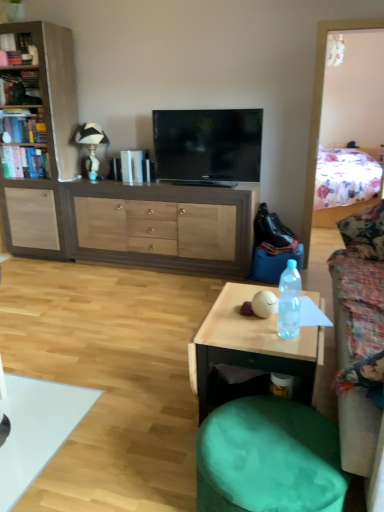
Question: From a real-world perspective, is green fabric swivel chair at lower right located beneath clear plastic bottle at center?

Choices:
 (A) yes
 (B) no

Answer: (A)

Question: Is green fabric swivel chair at lower right closer to the viewer compared to clear plastic bottle at center?

Choices:
 (A) yes
 (B) no

Answer: (A)

Question: From the image's perspective, is green fabric swivel chair at lower right under clear plastic bottle at center?

Choices:
 (A) no
 (B) yes

Answer: (B)

Question: Considering the relative sizes of green fabric swivel chair at lower right and clear plastic bottle at center in the image provided, is green fabric swivel chair at lower right thinner than clear plastic bottle at center?

Choices:
 (A) no
 (B) yes

Answer: (A)

Question: Does green fabric swivel chair at lower right lie behind clear plastic bottle at center?

Choices:
 (A) no
 (B) yes

Answer: (A)

Question: Is brown wood cabinet at center inside the boundaries of hardcover book at left, the 1th book when ordered from bottom to top, or outside?

Choices:
 (A) outside
 (B) inside

Answer: (A)

Question: Is point (251, 207) closer or farther from the camera than point (16, 159)?

Choices:
 (A) closer
 (B) farther

Answer: (A)

Question: Considering the positions of brown wood cabinet at center and hardcover book at left, the 4th book viewed from the top, in the image, is brown wood cabinet at center taller or shorter than hardcover book at left, the 4th book viewed from the top,?

Choices:
 (A) tall
 (B) short

Answer: (A)

Question: Based on their sizes in the image, would you say brown wood cabinet at center is bigger or smaller than hardcover book at left, the 4th book viewed from the top?

Choices:
 (A) big
 (B) small

Answer: (A)

Question: In terms of width, does clear plastic bottle at center look wider or thinner when compared to floral fabric couch at right?

Choices:
 (A) wide
 (B) thin

Answer: (B)

Question: Choose the correct answer: Is clear plastic bottle at center inside floral fabric couch at right or outside it?

Choices:
 (A) inside
 (B) outside

Answer: (B)

Question: From a real-world perspective, relative to floral fabric couch at right, is clear plastic bottle at center vertically above or below?

Choices:
 (A) above
 (B) below

Answer: (A)

Question: From the image's perspective, relative to floral fabric couch at right, is clear plastic bottle at center above or below?

Choices:
 (A) above
 (B) below

Answer: (A)

Question: Is clear plastic bottle at center situated inside matte wood cabinet at left or outside?

Choices:
 (A) outside
 (B) inside

Answer: (A)

Question: In terms of size, does clear plastic bottle at center appear bigger or smaller than matte wood cabinet at left?

Choices:
 (A) small
 (B) big

Answer: (A)